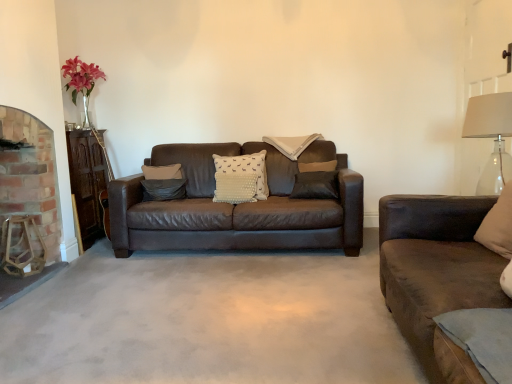
Question: Is clear glass lampshade at right wider than brick fireplace at left?

Choices:
 (A) yes
 (B) no

Answer: (A)

Question: From the image's perspective, is clear glass lampshade at right located beneath brick fireplace at left?

Choices:
 (A) no
 (B) yes

Answer: (A)

Question: Is clear glass lampshade at right outside brick fireplace at left?

Choices:
 (A) yes
 (B) no

Answer: (A)

Question: Considering the relative sizes of clear glass lampshade at right and brick fireplace at left in the image provided, is clear glass lampshade at right bigger than brick fireplace at left?

Choices:
 (A) yes
 (B) no

Answer: (B)

Question: Can brick fireplace at left be found inside clear glass lampshade at right?

Choices:
 (A) yes
 (B) no

Answer: (B)

Question: Is clear glass lampshade at right positioned with its back to brick fireplace at left?

Choices:
 (A) no
 (B) yes

Answer: (A)

Question: Is brick fireplace at left looking in the opposite direction of suede pillow at center, the first pillow viewed from the left?

Choices:
 (A) no
 (B) yes

Answer: (A)

Question: From a real-world perspective, is brick fireplace at left on suede pillow at center, arranged as the second pillow when viewed from the back?

Choices:
 (A) yes
 (B) no

Answer: (A)

Question: Can you confirm if brick fireplace at left is shorter than suede pillow at center, arranged as the second pillow when viewed from the back?

Choices:
 (A) no
 (B) yes

Answer: (A)

Question: Does brick fireplace at left appear on the right side of suede pillow at center, the first pillow viewed from the left?

Choices:
 (A) yes
 (B) no

Answer: (B)

Question: From a real-world perspective, is brick fireplace at left positioned under suede pillow at center, arranged as the second pillow when viewed from the back, based on gravity?

Choices:
 (A) no
 (B) yes

Answer: (A)

Question: Can you confirm if brick fireplace at left is smaller than suede pillow at center, which ranks as the fourth pillow in right-to-left order?

Choices:
 (A) yes
 (B) no

Answer: (B)

Question: Considering the relative sizes of suede pillow at center, arranged as the second pillow when viewed from the back, and brick fireplace at left in the image provided, is suede pillow at center, arranged as the second pillow when viewed from the back, thinner than brick fireplace at left?

Choices:
 (A) yes
 (B) no

Answer: (A)